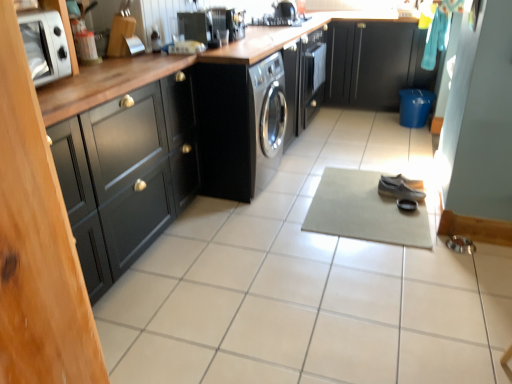
Locate an element on the screen. This screenshot has width=512, height=384. free space on the front side of beige fabric yoga mat at center is located at coordinates (391, 281).